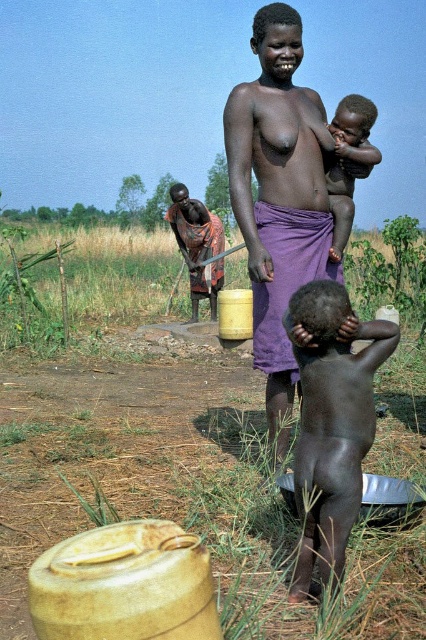
You are a drone operator trying to capture aerial footage of the rural scene. You need to ensure that both points, point (350, 513) and point (192, 252), are visible in your shot. Given their spatial relationship, which point should be positioned closer to the camera to maintain both in frame?

Point (350, 513) is in front of point (192, 252), so positioning the drone closer to point (350, 513) will keep both points visible while ensuring the foreground point remains in focus.

You are a photographer trying to capture a clear image of the matte purple cloth at center and the dark skin baby at center. Since you want both to be in focus, you need to adjust your camera settings. Which object should you focus on first to ensure both are sharp?

The matte purple cloth at center is bigger than the dark skin baby at center, so focusing on the matte purple cloth at center first will help ensure both are in focus.

Based on the photo, you are a photographer trying to capture the scene. You notice two points in the image at coordinates point (365, 125) and point (207, 269). Which point would appear larger in your photo?

Point (365, 125) is closer to the camera than point (207, 269), so it would appear larger in the photo.